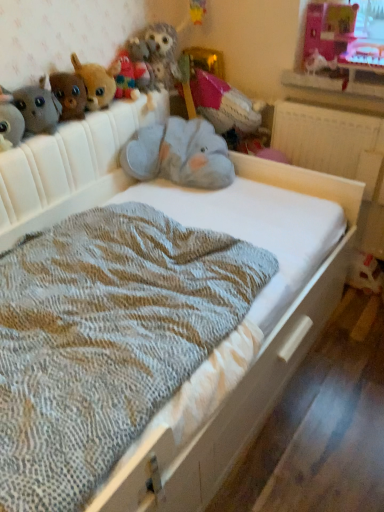
Question: From a real-world perspective, is brown plush toy at upper left, which is the 4th toy in right-to-left order, under fuzzy fabric owl at upper center, the 1th animal from the left?

Choices:
 (A) no
 (B) yes

Answer: (B)

Question: From the image's perspective, is brown plush toy at upper left, which is the 4th toy in right-to-left order, on fuzzy fabric owl at upper center, the 1th animal from the left?

Choices:
 (A) no
 (B) yes

Answer: (A)

Question: Can you confirm if brown plush toy at upper left, the third toy when ordered from left to right, is shorter than fuzzy fabric owl at upper center, the 1th animal from the left?

Choices:
 (A) no
 (B) yes

Answer: (B)

Question: From a real-world perspective, is brown plush toy at upper left, which is the 4th toy in right-to-left order, located higher than fuzzy fabric owl at upper center, which is the second animal in right-to-left order?

Choices:
 (A) no
 (B) yes

Answer: (A)

Question: Is brown plush toy at upper left, which is the 4th toy in right-to-left order, positioned in front of fuzzy fabric owl at upper center, the 1th animal from the left?

Choices:
 (A) yes
 (B) no

Answer: (A)

Question: Is brown plush toy at upper left, the third toy when ordered from left to right, not inside fuzzy fabric owl at upper center, the 1th animal from the left?

Choices:
 (A) no
 (B) yes

Answer: (B)

Question: From the image's perspective, does pink fabric stuffed animal at upper center, marked as the 1th toy in a right-to-left arrangement, appear lower than fuzzy fabric owl at upper center, the 1th animal from the left?

Choices:
 (A) no
 (B) yes

Answer: (B)

Question: Is pink fabric stuffed animal at upper center, marked as the 1th toy in a right-to-left arrangement, positioned with its back to fuzzy fabric owl at upper center, the 1th animal from the left?

Choices:
 (A) no
 (B) yes

Answer: (B)

Question: Considering the relative sizes of pink fabric stuffed animal at upper center, marked as the 1th toy in a right-to-left arrangement, and fuzzy fabric owl at upper center, the 1th animal from the left, in the image provided, is pink fabric stuffed animal at upper center, marked as the 1th toy in a right-to-left arrangement, bigger than fuzzy fabric owl at upper center, the 1th animal from the left,?

Choices:
 (A) no
 (B) yes

Answer: (B)

Question: Is pink fabric stuffed animal at upper center, marked as the 1th toy in a right-to-left arrangement, not within fuzzy fabric owl at upper center, which is the second animal in right-to-left order?

Choices:
 (A) yes
 (B) no

Answer: (A)

Question: Could you tell me if pink fabric stuffed animal at upper center, which ranks as the sixth toy in left-to-right order, is turned towards fuzzy fabric owl at upper center, which is the second animal in right-to-left order?

Choices:
 (A) no
 (B) yes

Answer: (A)

Question: From a real-world perspective, is pink fabric stuffed animal at upper center, which ranks as the sixth toy in left-to-right order, physically above fuzzy fabric owl at upper center, the 1th animal from the left?

Choices:
 (A) yes
 (B) no

Answer: (B)

Question: Can you confirm if fuzzy fabric stuffed animal at upper left, which is the fifth toy from right to left, is thinner than white glossy bird at upper right, which appears as the first animal when viewed from the right?

Choices:
 (A) yes
 (B) no

Answer: (B)